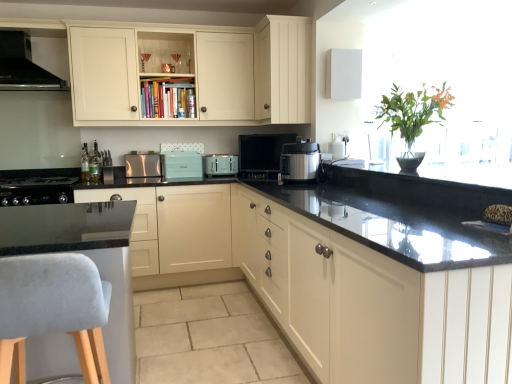
Question: Which direction should I rotate to look at satin silver pressure cooker at center, placed as the first kitchen appliance when sorted from bottom to top, — up or down?

Choices:
 (A) up
 (B) down

Answer: (A)

Question: Does metallic silver toaster at center, which is counted as the first appliance, starting from the right, lie behind teal matte toaster at center, which ranks as the 2th appliance in left-to-right order?

Choices:
 (A) no
 (B) yes

Answer: (A)

Question: Can you confirm if metallic silver toaster at center, which is counted as the first appliance, starting from the right, is taller than teal matte toaster at center, which is counted as the 2th appliance, starting from the right?

Choices:
 (A) no
 (B) yes

Answer: (A)

Question: Is metallic silver toaster at center, acting as the third appliance starting from the left, positioned far away from teal matte toaster at center, which ranks as the 2th appliance in left-to-right order?

Choices:
 (A) no
 (B) yes

Answer: (B)

Question: Is metallic silver toaster at center, which is counted as the first appliance, starting from the right, closer to the viewer compared to teal matte toaster at center, which ranks as the 2th appliance in left-to-right order?

Choices:
 (A) no
 (B) yes

Answer: (B)

Question: Considering the relative sizes of metallic silver toaster at center, which is counted as the first appliance, starting from the right, and teal matte toaster at center, which is counted as the 2th appliance, starting from the right, in the image provided, is metallic silver toaster at center, which is counted as the first appliance, starting from the right, bigger than teal matte toaster at center, which is counted as the 2th appliance, starting from the right,?

Choices:
 (A) no
 (B) yes

Answer: (A)

Question: Can you confirm if metallic silver toaster at center, which is counted as the first appliance, starting from the right, is thinner than teal matte toaster at center, which is counted as the 2th appliance, starting from the right?

Choices:
 (A) yes
 (B) no

Answer: (A)

Question: Would you consider black matte range hood at upper left, placed as the 4th kitchen appliance when sorted from right to left, to be distant from clear glass bottle at left, marked as the 2th bottle in a back-to-front arrangement?

Choices:
 (A) no
 (B) yes

Answer: (A)

Question: Can you see black matte range hood at upper left, which appears as the first kitchen appliance when viewed from the left, touching clear glass bottle at left, marked as the 2th bottle in a back-to-front arrangement?

Choices:
 (A) yes
 (B) no

Answer: (B)

Question: Is black matte range hood at upper left, which ranks as the fourth kitchen appliance in bottom-to-top order, further to the viewer compared to clear glass bottle at left, marked as the 2th bottle in a back-to-front arrangement?

Choices:
 (A) no
 (B) yes

Answer: (A)

Question: From a real-world perspective, does black matte range hood at upper left, which appears as the first kitchen appliance when viewed from the left, sit lower than clear glass bottle at left, acting as the first bottle starting from the front?

Choices:
 (A) no
 (B) yes

Answer: (A)

Question: Does black matte range hood at upper left, placed as the 4th kitchen appliance when sorted from right to left, have a lesser height compared to clear glass bottle at left, marked as the 2th bottle in a back-to-front arrangement?

Choices:
 (A) no
 (B) yes

Answer: (A)

Question: Does black matte range hood at upper left, which appears as the first kitchen appliance when viewed from the left, have a larger size compared to clear glass bottle at left, acting as the first bottle starting from the front?

Choices:
 (A) yes
 (B) no

Answer: (A)

Question: Can you confirm if metallic silver toaster at center, which is counted as the first appliance, starting from the right, is positioned to the left of cream matte cabinet at upper center, the third cabinetry when ordered from bottom to top?

Choices:
 (A) no
 (B) yes

Answer: (A)